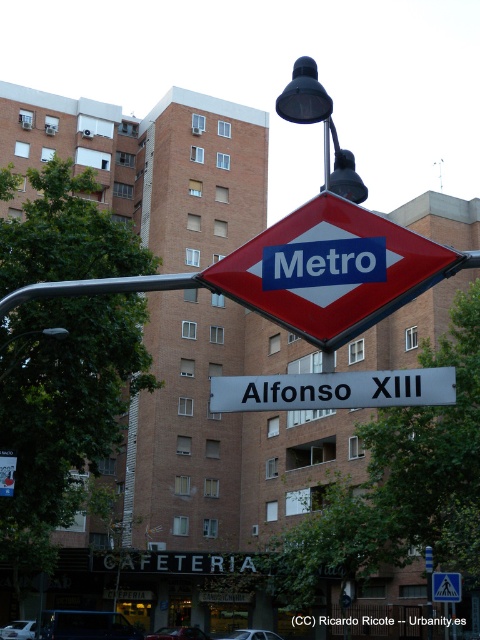
You are a pedestrian standing at the entrance of the building. You notice the yellow reflective triangle at upper center and the metallic pole at lower left. Which object is taller from your viewpoint?

The yellow reflective triangle at upper center is taller than the metallic pole at lower left according to the description.

Based on the photo, you are a city planner assessing the visibility of road signs in a busy area. You notice the white metallic signboard at center and the yellow reflective triangle at upper center. Which of these two objects is wider?

The white metallic signboard at center is wider than the yellow reflective triangle at upper center according to the description.